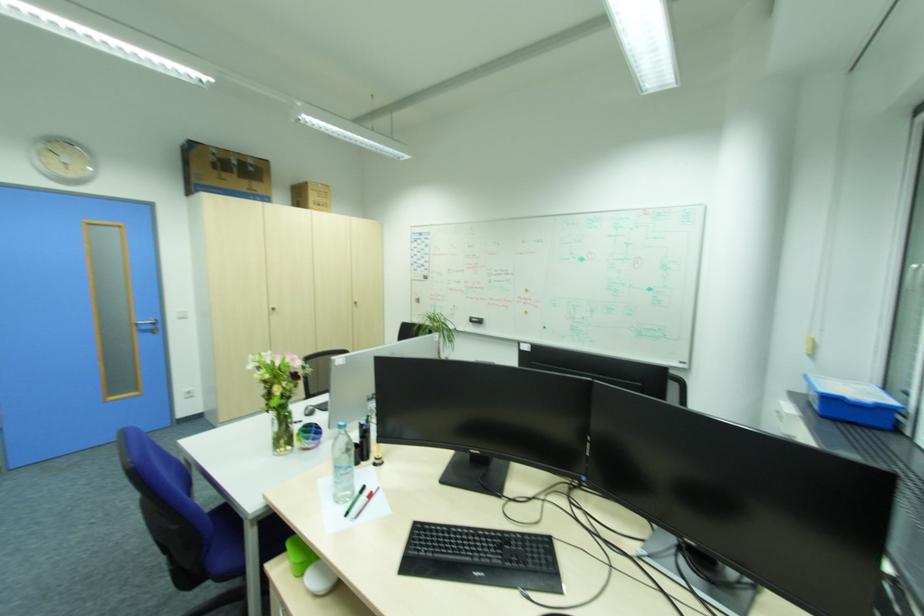
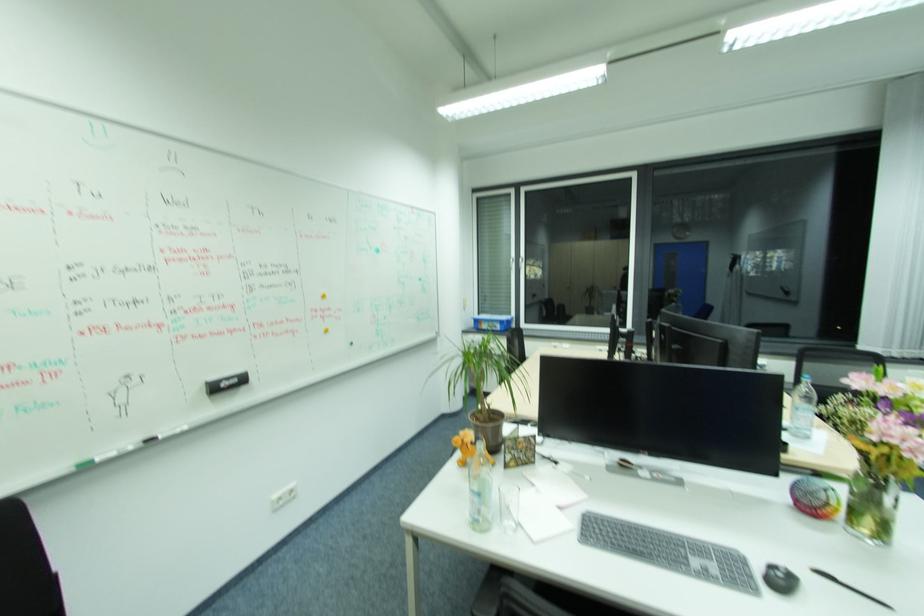
The point at (482, 318) is marked in the first image. Where is the corresponding point in the second image?

(240, 381)